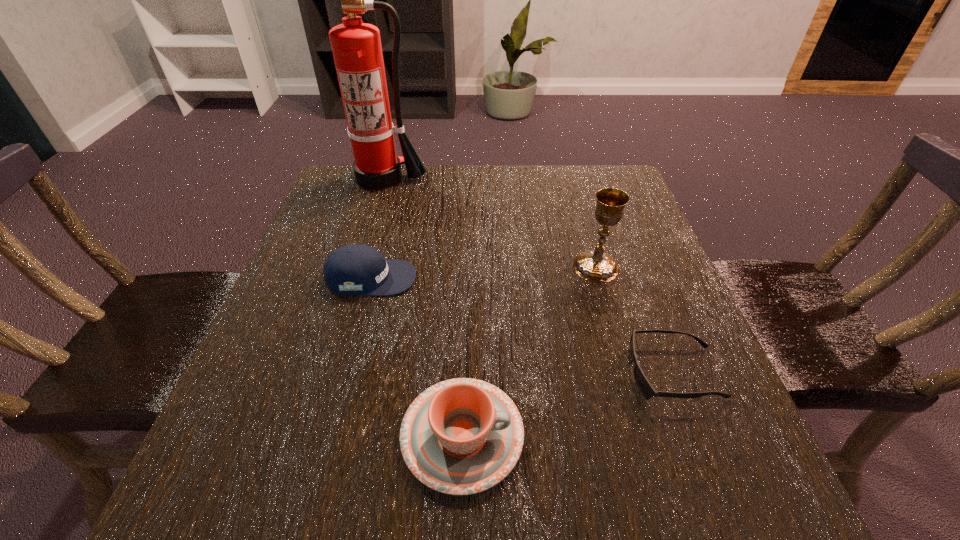
Identify the location of vacant position in the image that satisfies the following two spatial constraints: 1. at the nozzle of the farthest object; 2. on the right side of the chalice. (355, 267).